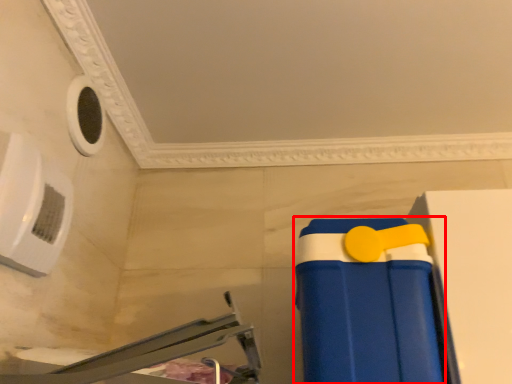
Question: Where is toy (annotated by the red box) located in relation to furniture in the image?

Choices:
 (A) right
 (B) left

Answer: (A)